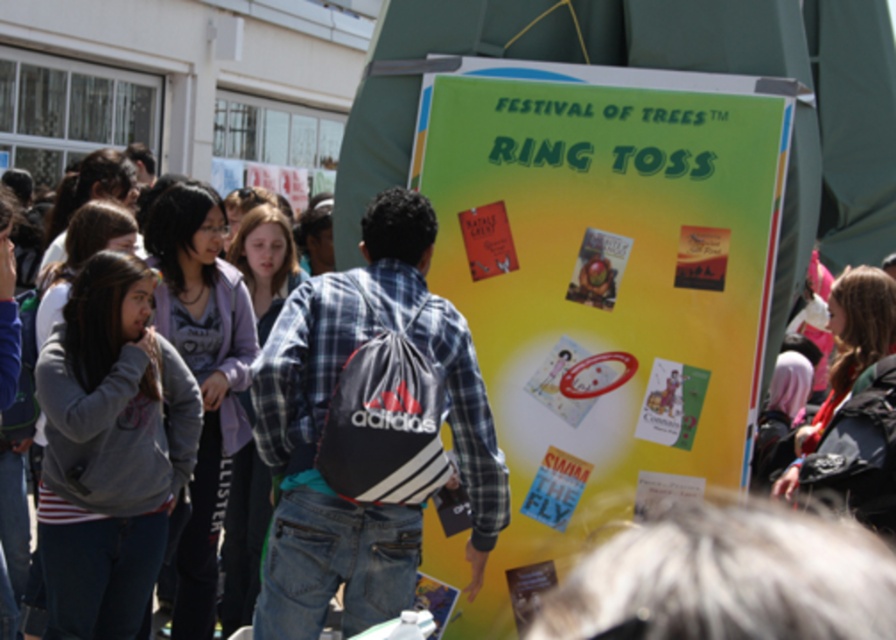
What are the coordinates of `yellow paper poster at center` in the screenshot? It's located at (600, 296).

Between yellow paper poster at center and gray fleece jacket at center, which one is positioned higher?

Positioned higher is yellow paper poster at center.

Which is in front, point (530, 298) or point (214, 227)?

Point (530, 298)

The height and width of the screenshot is (640, 896). I want to click on yellow paper poster at center, so click(600, 296).

Who is shorter, yellow paper poster at center or plaid shirt at center?

Standing shorter between the two is plaid shirt at center.

Between yellow paper poster at center and plaid shirt at center, which one is positioned lower?

plaid shirt at center is below.

Who is more forward, (712, 301) or (324, 496)?

Point (324, 496) is in front.

This screenshot has width=896, height=640. I want to click on yellow paper poster at center, so click(600, 296).

Which of these two, plaid shirt at center or gray fleece jacket at center, stands taller?

With more height is gray fleece jacket at center.

Is point (283, 524) farther from viewer compared to point (243, 324)?

No, (283, 524) is in front of (243, 324).

What do you see at coordinates (323, 422) in the screenshot? I see `plaid shirt at center` at bounding box center [323, 422].

Locate an element on the screen. The image size is (896, 640). plaid shirt at center is located at coordinates (323, 422).